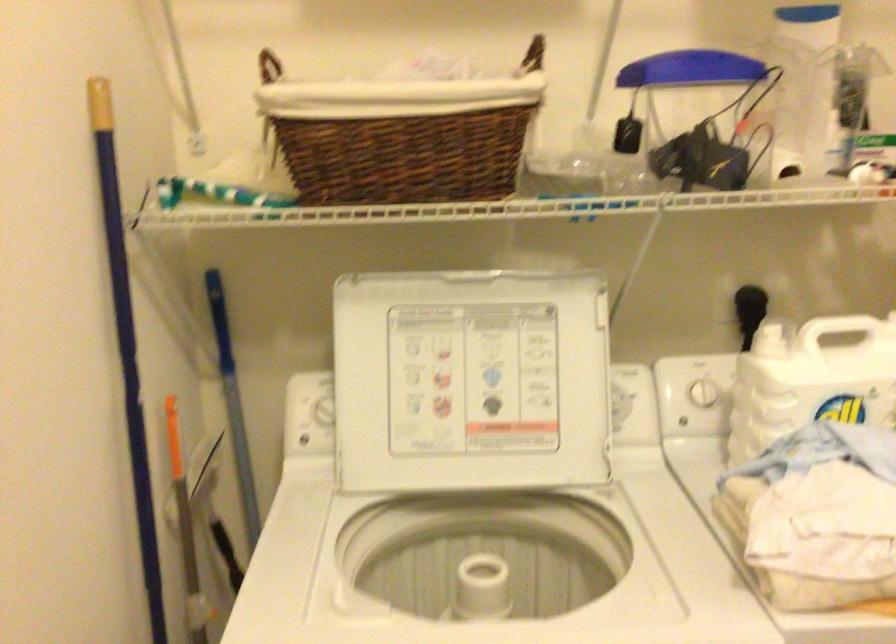
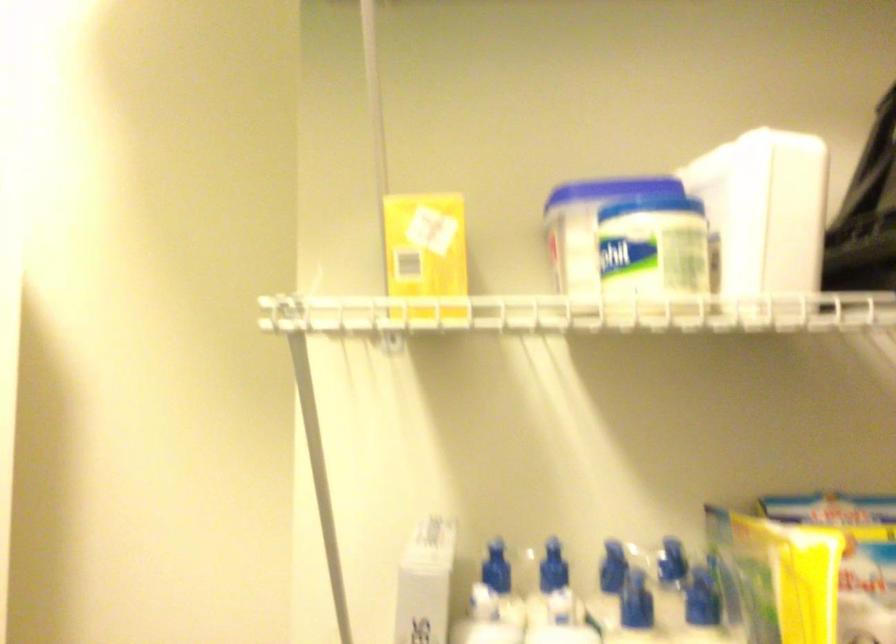
Question: The images are taken continuously from a first-person perspective. In which direction is your viewpoint rotating?

Choices:
 (A) Left
 (B) Right
 (C) Up
 (D) Down

Answer: (B)